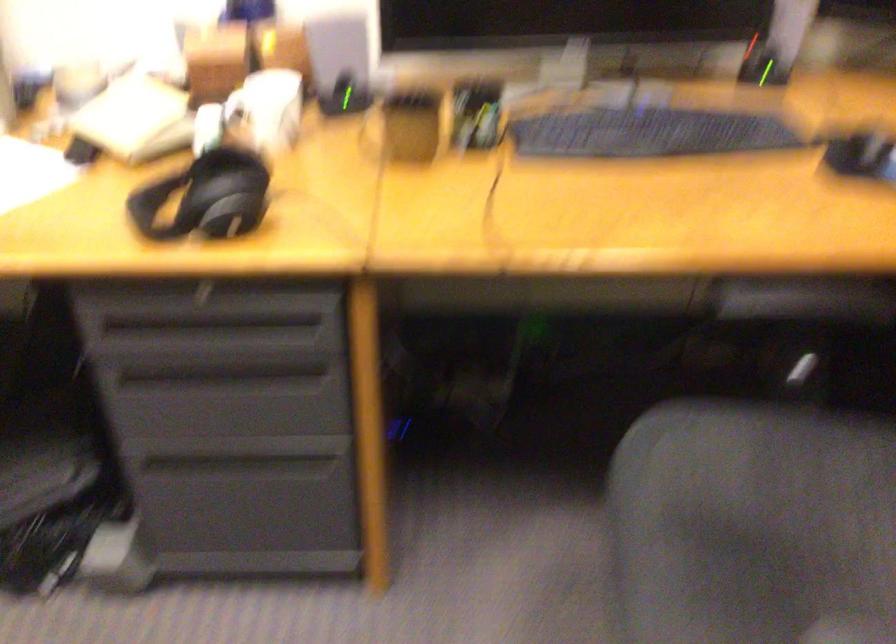
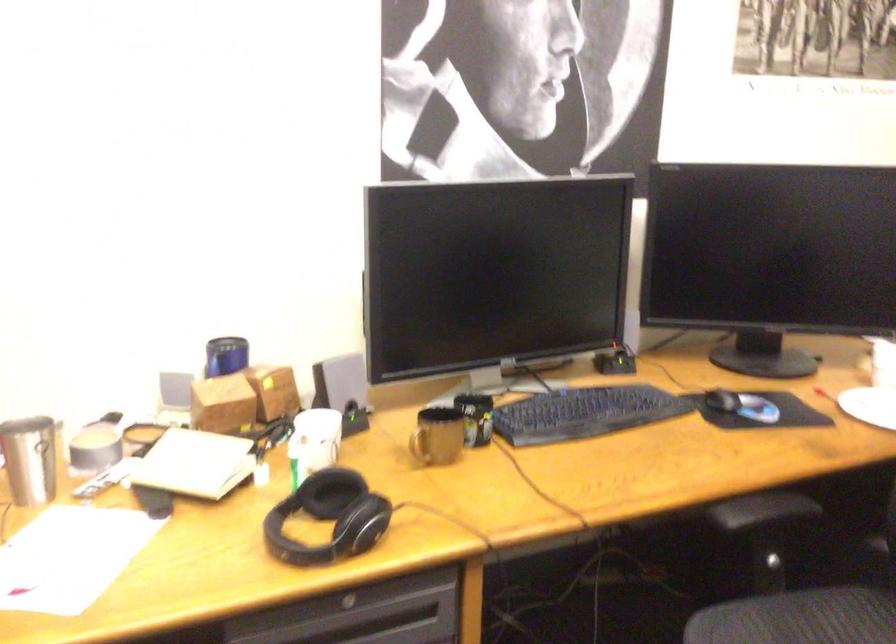
Locate, in the second image, the point that corresponds to point (796, 327) in the first image.

(762, 529)